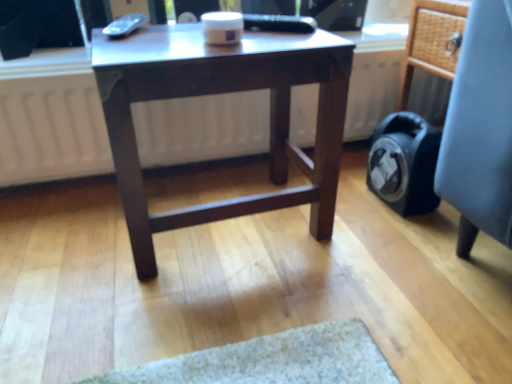
Locate an element on the screen. vacant area located to the right-hand side of dark brown wood table at center is located at coordinates (384, 241).